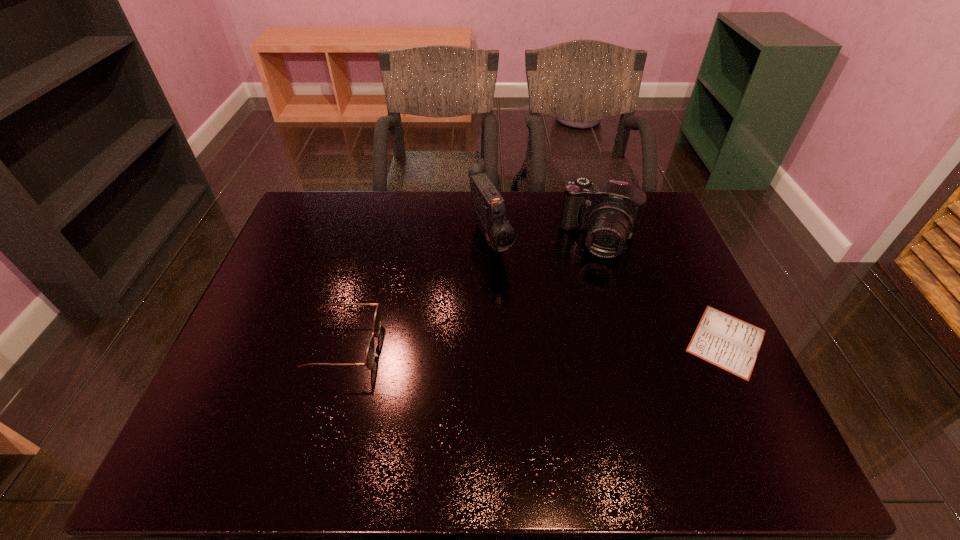
Identify the location of vacant space on the desktop that is between the leftmost object and the shortest object and is positioned on the lens of the second object from right to left. (572, 343).

This screenshot has height=540, width=960. What are the coordinates of `free space on the desktop that is between the leftmost object and the rightmost object and is positioned on the front-facing side of the tallest object` in the screenshot? It's located at (546, 344).